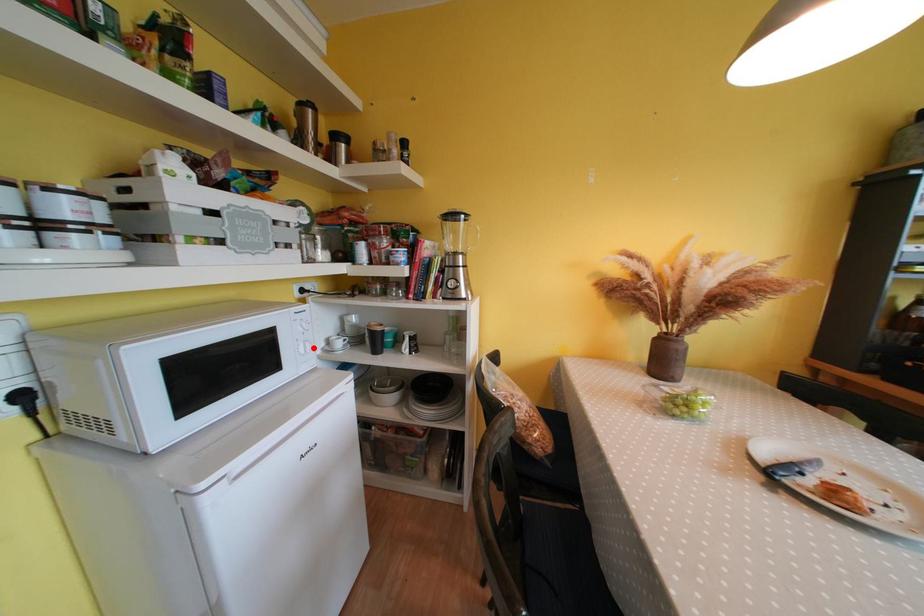
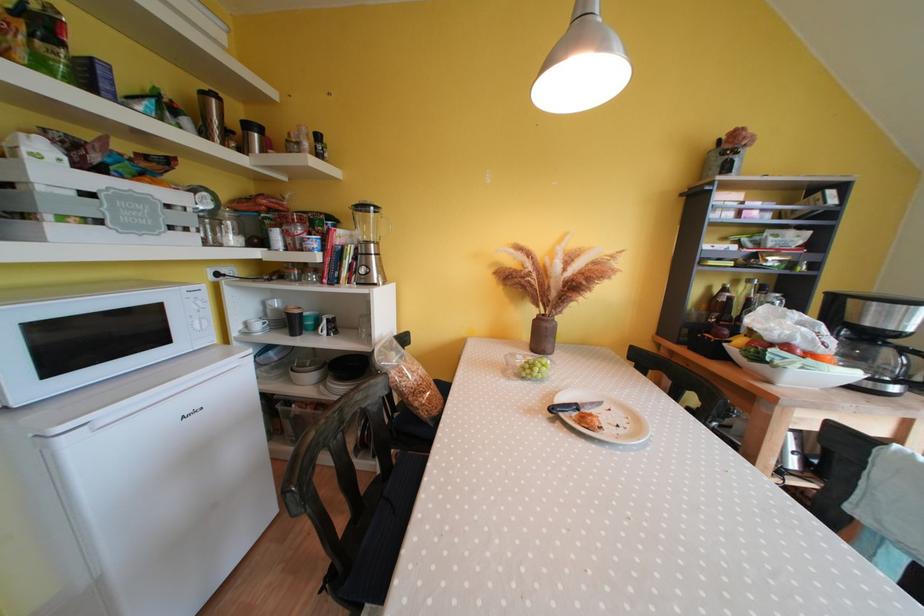
Where in the second image is the point corresponding to the highlighted location from the first image?

(210, 325)